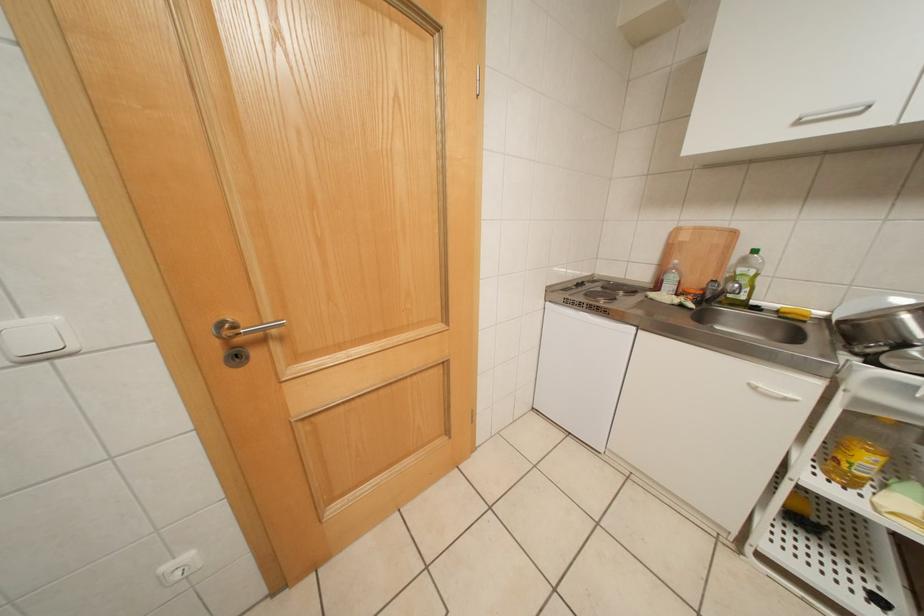
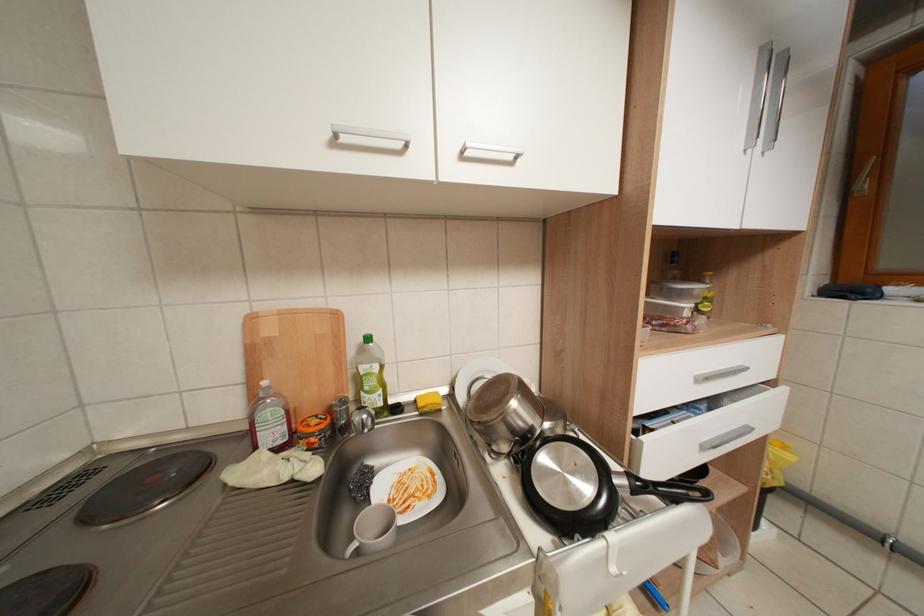
Question: How did the camera likely rotate?

Choices:
 (A) Left
 (B) Right
 (C) Up
 (D) Down

Answer: (B)